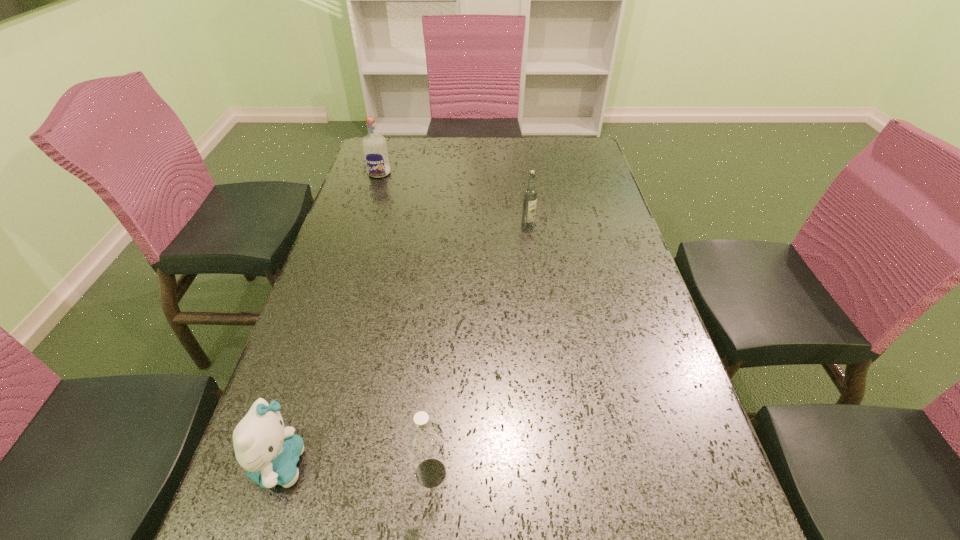
At what (x,y) coordinates should I click in order to perform the action: click on the third closest object to the kitten. Please return your answer as a coordinate pair (x, y). This screenshot has width=960, height=540. Looking at the image, I should click on (374, 145).

What are the coordinates of `object that is the closest to the shortest object` in the screenshot? It's located at (424, 439).

Identify the location of vodka object that ranks as the closest to the rightmost object. The image size is (960, 540). (374, 145).

Identify the location of vodka that is the nearest to the second farthest vodka. The image size is (960, 540). click(x=374, y=145).

Locate an element on the screen. The image size is (960, 540). free space that satisfies the following two spatial constraints: 1. on the label of the rightmost object; 2. on the front label of the second vodka from left to right is located at coordinates [x=560, y=473].

Locate an element on the screen. vacant position in the image that satisfies the following two spatial constraints: 1. on the label of the rightmost vodka; 2. on the face of the kitten is located at coordinates (559, 464).

Locate an element on the screen. The image size is (960, 540). free location that satisfies the following two spatial constraints: 1. on the label of the rightmost vodka; 2. on the front label of the second object from right to left is located at coordinates (560, 473).